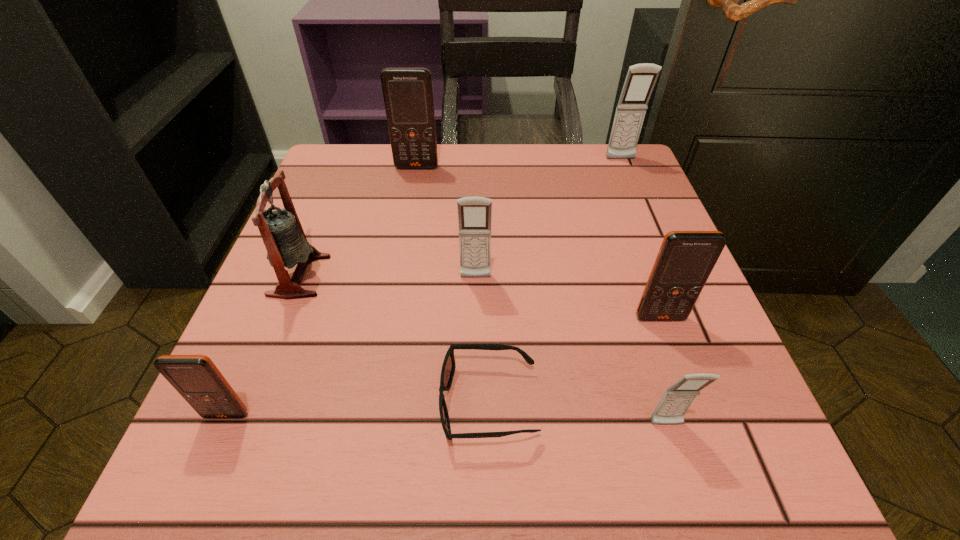
Where is `vacant space located 0.080m on the front-facing side of the nearest gray cellular telephone`? The width and height of the screenshot is (960, 540). vacant space located 0.080m on the front-facing side of the nearest gray cellular telephone is located at coordinates (688, 495).

This screenshot has height=540, width=960. In order to click on free space located on the front-facing side of the shortest object in this screenshot , I will do (209, 403).

The image size is (960, 540). Find the location of `free region located on the front-facing side of the shortest object`. free region located on the front-facing side of the shortest object is located at coordinates (209, 403).

I want to click on vacant space located 0.200m on the front-facing side of the shortest object, so (296, 403).

Locate an element on the screen. cellular telephone present at the near edge is located at coordinates (x=677, y=399).

Locate an element on the screen. sunglasses that is at the near edge is located at coordinates (448, 368).

This screenshot has width=960, height=540. I want to click on bell located in the left edge section of the desktop, so click(281, 231).

Locate an element on the screen. This screenshot has height=540, width=960. cellular telephone at the left edge is located at coordinates (196, 378).

Where is `object that is positioned at the far right corner`? The width and height of the screenshot is (960, 540). object that is positioned at the far right corner is located at coordinates (641, 78).

Where is `object present at the near right corner`? object present at the near right corner is located at coordinates (677, 399).